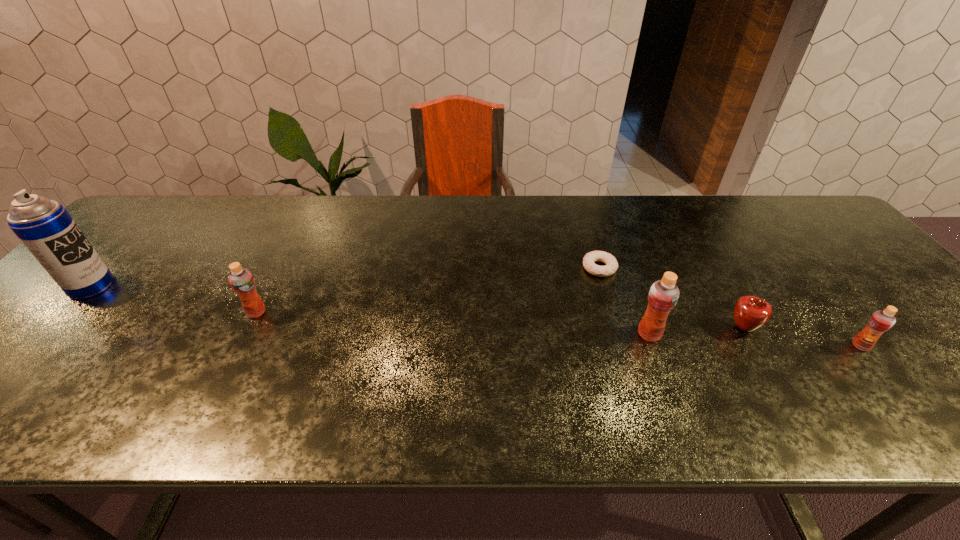
Where is `vacant space that is in between the second shortest object and the rightmost object`? vacant space that is in between the second shortest object and the rightmost object is located at coordinates (802, 337).

Find the location of a particular element. vacant space that is in between the leftmost object and the rightmost orange juice is located at coordinates (476, 316).

This screenshot has height=540, width=960. I want to click on object identified as the second closest to the fifth shortest object, so click(x=751, y=313).

The height and width of the screenshot is (540, 960). I want to click on object that ranks as the fourth closest to the aerosol can, so click(x=751, y=313).

Choose which orange juice is the second nearest neighbor to the shortest orange juice. Please provide its 2D coordinates. Your answer should be formatted as a tuple, i.e. [(x, y)], where the tuple contains the x and y coordinates of a point satisfying the conditions above.

[(241, 280)]

Select which orange juice appears as the second closest to the second shortest orange juice. Please provide its 2D coordinates. Your answer should be formatted as a tuple, i.e. [(x, y)], where the tuple contains the x and y coordinates of a point satisfying the conditions above.

[(880, 321)]

Find the location of a particular element. free spot that satisfies the following two spatial constraints: 1. on the back side of the fifth object from left to right; 2. on the label side of the aerosol can is located at coordinates (719, 286).

Identify the location of free location that satisfies the following two spatial constraints: 1. on the back side of the second tallest orange juice; 2. on the right side of the shortest object. This screenshot has width=960, height=540. (279, 268).

What are the coordinates of `blank area in the image that satisfies the following two spatial constraints: 1. on the label side of the rightmost orange juice; 2. on the right side of the leftmost object` in the screenshot? It's located at (35, 346).

Locate an element on the screen. vacant space that satisfies the following two spatial constraints: 1. on the back side of the tallest orange juice; 2. on the left side of the apple is located at coordinates (647, 328).